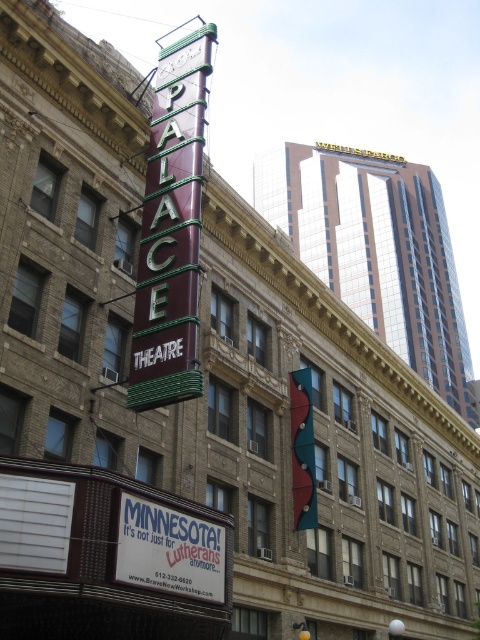
Question: Considering the relative positions of maroon enamel sign at center-left and white plastic sign at center in the image provided, where is maroon enamel sign at center-left located with respect to white plastic sign at center?

Choices:
 (A) above
 (B) below

Answer: (A)

Question: Which point is closer to the camera?

Choices:
 (A) (163, 566)
 (B) (170, 392)

Answer: (A)

Question: Is maroon enamel sign at center-left bigger than white plastic sign at center?

Choices:
 (A) yes
 (B) no

Answer: (A)

Question: Is maroon enamel sign at center-left closer to camera compared to white plastic sign at center?

Choices:
 (A) no
 (B) yes

Answer: (A)

Question: Among these objects, which one is nearest to the camera?

Choices:
 (A) maroon enamel sign at center-left
 (B) white plastic sign at center

Answer: (B)